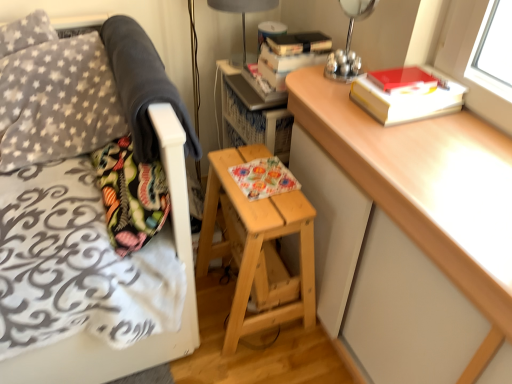
What do you see at coordinates (406, 94) in the screenshot?
I see `hardcover book at upper right, the 1th paperback book positioned from the bottom` at bounding box center [406, 94].

Where is `hardcover book at upper right, the 1th paperback book positioned from the bottom`? hardcover book at upper right, the 1th paperback book positioned from the bottom is located at coordinates (406, 94).

The height and width of the screenshot is (384, 512). I want to click on dark gray fleece blanket at upper left, so click(142, 86).

This screenshot has width=512, height=384. Identify the location of floral paper book at center, the 1th book from the bottom. click(x=263, y=178).

What do you see at coordinates (130, 195) in the screenshot? I see `fluffy fabric pillow at left` at bounding box center [130, 195].

What do you see at coordinates (428, 190) in the screenshot? This screenshot has height=384, width=512. I see `light wood desk at upper right` at bounding box center [428, 190].

Measure the distance between gray fleece throw pillow at upper left and camera.

gray fleece throw pillow at upper left and camera are 3.94 feet apart.

Find the location of `hardcover book at upper right, the second paperback book when ordered from top to bottom`. hardcover book at upper right, the second paperback book when ordered from top to bottom is located at coordinates (406, 94).

From a real-world perspective, relative to matte gray lampshade at upper center, placed as the 1th bedside lamp when sorted from left to right, is floral paper book at center, placed as the 2th book when sorted from top to bottom, vertically above or below?

In terms of real-world spatial position, floral paper book at center, placed as the 2th book when sorted from top to bottom, is below matte gray lampshade at upper center, placed as the 1th bedside lamp when sorted from left to right.

Does floral paper book at center, placed as the 2th book when sorted from top to bottom, appear on the left side of matte gray lampshade at upper center, placed as the 1th bedside lamp when sorted from left to right?

In fact, floral paper book at center, placed as the 2th book when sorted from top to bottom, is to the right of matte gray lampshade at upper center, placed as the 1th bedside lamp when sorted from left to right.

Could you tell me if floral paper book at center, placed as the 2th book when sorted from top to bottom, is facing matte gray lampshade at upper center, which appears as the second bedside lamp when viewed from the front?

No.

Locate an element on the screen. The height and width of the screenshot is (384, 512). book that is the 2nd one below the matte gray lampshade at upper center, the 1th bedside lamp positioned from the back (from a real-world perspective) is located at coordinates (263, 178).

Looking at this image, is metallic silver lamp at upper right, which is counted as the 1th bedside lamp, starting from the right, wider or thinner than light wood desk at upper right?

Considering their sizes, metallic silver lamp at upper right, which is counted as the 1th bedside lamp, starting from the right, looks slimmer than light wood desk at upper right.

From the image's perspective, between metallic silver lamp at upper right, arranged as the second bedside lamp when viewed from the back, and light wood desk at upper right, which one is located above?

metallic silver lamp at upper right, arranged as the second bedside lamp when viewed from the back, from the image's perspective.

Can you see metallic silver lamp at upper right, arranged as the second bedside lamp when viewed from the back, touching light wood desk at upper right?

metallic silver lamp at upper right, arranged as the second bedside lamp when viewed from the back, is not next to light wood desk at upper right, and they're not touching.

Can we say metallic silver lamp at upper right, which is counted as the 1th bedside lamp, starting from the right, lies outside light wood desk at upper right?

Indeed, metallic silver lamp at upper right, which is counted as the 1th bedside lamp, starting from the right, is completely outside light wood desk at upper right.

In the scene shown: Is hardcover book at upper right, the second paperback book when ordered from top to bottom, shorter than hardcover book at upper center, arranged as the 2th book when ordered from the bottom?

Correct, hardcover book at upper right, the second paperback book when ordered from top to bottom, is not as tall as hardcover book at upper center, arranged as the 2th book when ordered from the bottom.

From a real-world perspective, is hardcover book at upper right, the 1th paperback book positioned from the bottom, located higher than hardcover book at upper center, the first book when ordered from top to bottom?

Indeed, from a real-world perspective, hardcover book at upper right, the 1th paperback book positioned from the bottom, stands above hardcover book at upper center, the first book when ordered from top to bottom.

Relative to hardcover book at upper center, arranged as the 2th book when ordered from the bottom, is hardcover book at upper right, the 1th paperback book positioned from the bottom, in front or behind?

Clearly, hardcover book at upper right, the 1th paperback book positioned from the bottom, is in front of hardcover book at upper center, arranged as the 2th book when ordered from the bottom.

Are hardcover book at upper right, the second paperback book when ordered from top to bottom, and hardcover book at upper center, the first book when ordered from top to bottom, making contact?

No, hardcover book at upper right, the second paperback book when ordered from top to bottom, is not next to hardcover book at upper center, the first book when ordered from top to bottom.

Consider the image. From the image's perspective, would you say hardcover book at upper center, arranged as the 2th book when ordered from the bottom, is shown under gray fleece throw pillow at upper left?

No.

Is hardcover book at upper center, the first book when ordered from top to bottom, to the right of gray fleece throw pillow at upper left from the viewer's perspective?

Indeed, hardcover book at upper center, the first book when ordered from top to bottom, is positioned on the right side of gray fleece throw pillow at upper left.

Is hardcover book at upper center, arranged as the 2th book when ordered from the bottom, inside or outside of gray fleece throw pillow at upper left?

hardcover book at upper center, arranged as the 2th book when ordered from the bottom, is located beyond the bounds of gray fleece throw pillow at upper left.

Which of these two, hardcover book at upper center, the first book when ordered from top to bottom, or gray fleece throw pillow at upper left, is wider?

gray fleece throw pillow at upper left is wider.

Which book is the 1st one when counting from the right side of the dark gray fleece blanket at upper left? Please provide its 2D coordinates.

[(263, 178)]

Considering the sizes of objects floral paper book at center, the 1th book from the bottom, and dark gray fleece blanket at upper left in the image provided, who is shorter, floral paper book at center, the 1th book from the bottom, or dark gray fleece blanket at upper left?

Standing shorter between the two is floral paper book at center, the 1th book from the bottom.

Does floral paper book at center, the 1th book from the bottom, turn towards dark gray fleece blanket at upper left?

No.

Consider the image. Measure the distance between floral paper book at center, placed as the 2th book when sorted from top to bottom, and dark gray fleece blanket at upper left.

floral paper book at center, placed as the 2th book when sorted from top to bottom, and dark gray fleece blanket at upper left are 12.85 inches apart.

Does point (53, 70) come farther from viewer compared to point (454, 101)?

Yes.

From a real-world perspective, is gray fleece throw pillow at upper left beneath hardcover book at upper right, the second paperback book when ordered from top to bottom?

Correct, in the physical world, gray fleece throw pillow at upper left is lower than hardcover book at upper right, the second paperback book when ordered from top to bottom.

From the image's perspective, is gray fleece throw pillow at upper left over hardcover book at upper right, the 1th paperback book positioned from the bottom?

Correct, gray fleece throw pillow at upper left appears higher than hardcover book at upper right, the 1th paperback book positioned from the bottom, in the image.

Relative to hardcover book at upper right, the 1th paperback book positioned from the bottom, is gray fleece throw pillow at upper left in front or behind?

gray fleece throw pillow at upper left is behind hardcover book at upper right, the 1th paperback book positioned from the bottom.

Considering the sizes of objects matte red paperback book at upper right, which is counted as the first paperback book, starting from the top, and dark gray fleece blanket at upper left in the image provided, who is smaller, matte red paperback book at upper right, which is counted as the first paperback book, starting from the top, or dark gray fleece blanket at upper left?

With smaller size is matte red paperback book at upper right, which is counted as the first paperback book, starting from the top.

You are a GUI agent. You are given a task and a screenshot of the screen. Output one action in this format:
    pyautogui.click(x=<x>, y=<y>)
    Task: Click on the blanket located underneath the matte red paperback book at upper right, which appears as the second paperback book when ordered from the bottom (from a real-world perspective)
    The width and height of the screenshot is (512, 384).
    Given the screenshot: What is the action you would take?
    142,86

Is point (417, 74) behind point (106, 44)?

No, (417, 74) is closer to viewer.

You are a GUI agent. You are given a task and a screenshot of the screen. Output one action in this format:
    pyautogui.click(x=<x>, y=<y>)
    Task: Click on the bedside lamp located behind the floral paper book at center, the 1th book from the bottom
    The width and height of the screenshot is (512, 384).
    Given the screenshot: What is the action you would take?
    pyautogui.click(x=243, y=21)

Locate an element on the screen. desk on the right of metallic silver lamp at upper right, arranged as the second bedside lamp when viewed from the back is located at coordinates (428, 190).

Estimate the real-world distances between objects in this image. Which object is closer to hardcover book at upper center, the first book when ordered from top to bottom, light wood desk at upper right or light brown wooden stool at center?

Among the two, light wood desk at upper right is located nearer to hardcover book at upper center, the first book when ordered from top to bottom.

When comparing their distances from floral paper book at center, the 1th book from the bottom, does gray fleece throw pillow at upper left or hardcover book at upper center, the first book when ordered from top to bottom, seem closer?

Based on the image, hardcover book at upper center, the first book when ordered from top to bottom, appears to be nearer to floral paper book at center, the 1th book from the bottom.

Looking at the image, which one is located further to metallic silver lamp at upper right, the first bedside lamp when ordered from front to back, dark gray fleece blanket at upper left or hardcover book at upper center, the first book when ordered from top to bottom?

dark gray fleece blanket at upper left is positioned further to the anchor metallic silver lamp at upper right, the first bedside lamp when ordered from front to back.

Estimate the real-world distances between objects in this image. Which object is closer to matte red paperback book at upper right, which appears as the second paperback book when ordered from the bottom, light brown wooden stool at center or metallic silver lamp at upper right, the 2th bedside lamp positioned from the left?

Among the two, metallic silver lamp at upper right, the 2th bedside lamp positioned from the left, is located nearer to matte red paperback book at upper right, which appears as the second paperback book when ordered from the bottom.

Based on their spatial positions, is gray fleece throw pillow at upper left or dark gray fleece blanket at upper left further from fluffy fabric pillow at left?

gray fleece throw pillow at upper left is positioned further to the anchor fluffy fabric pillow at left.

Based on their spatial positions, is matte red paperback book at upper right, which is counted as the first paperback book, starting from the top, or fluffy fabric pillow at left closer to light wood desk at upper right?

matte red paperback book at upper right, which is counted as the first paperback book, starting from the top, lies closer to light wood desk at upper right than the other object.

Considering their positions, is dark gray fleece blanket at upper left positioned closer to hardcover book at upper right, the second paperback book when ordered from top to bottom, than matte red paperback book at upper right, which appears as the second paperback book when ordered from the bottom?

matte red paperback book at upper right, which appears as the second paperback book when ordered from the bottom, is positioned closer to the anchor hardcover book at upper right, the second paperback book when ordered from top to bottom.

Based on their spatial positions, is hardcover book at upper right, the 1th paperback book positioned from the bottom, or light brown wooden stool at center closer to metallic silver lamp at upper right, arranged as the second bedside lamp when viewed from the back?

The object closer to metallic silver lamp at upper right, arranged as the second bedside lamp when viewed from the back, is hardcover book at upper right, the 1th paperback book positioned from the bottom.

Find the location of `desk between dark gray fleece blanket at upper left and matte red paperback book at upper right, which is counted as the first paperback book, starting from the top`. desk between dark gray fleece blanket at upper left and matte red paperback book at upper right, which is counted as the first paperback book, starting from the top is located at coordinates (428, 190).

Locate an element on the screen. paperback book located between floral paper book at center, the 1th book from the bottom, and hardcover book at upper right, the second paperback book when ordered from top to bottom, in the left-right direction is located at coordinates (403, 80).

Find the location of a particular element. Image resolution: width=512 pixels, height=384 pixels. blanket situated between gray fleece throw pillow at upper left and light wood desk at upper right from left to right is located at coordinates (142, 86).

The image size is (512, 384). I want to click on stool situated between fluffy fabric pillow at left and matte red paperback book at upper right, which appears as the second paperback book when ordered from the bottom, from left to right, so click(257, 248).